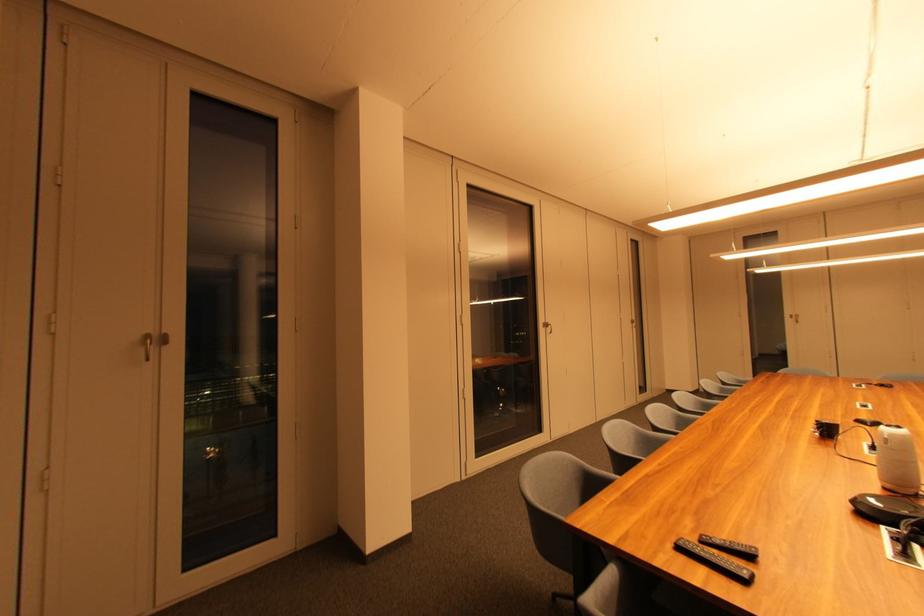
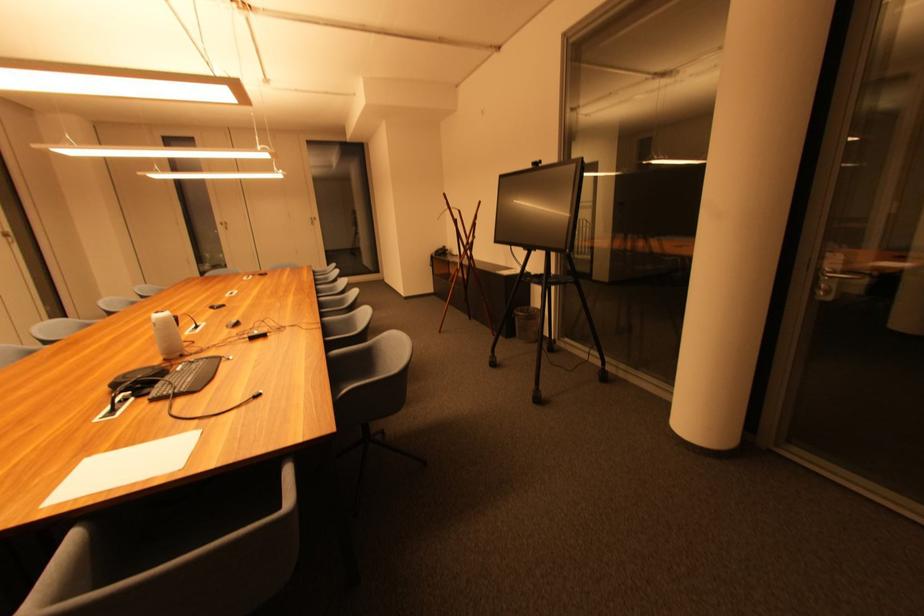
In the second image, find the point that corresponds to the point at 796,318 in the first image.

(226, 225)